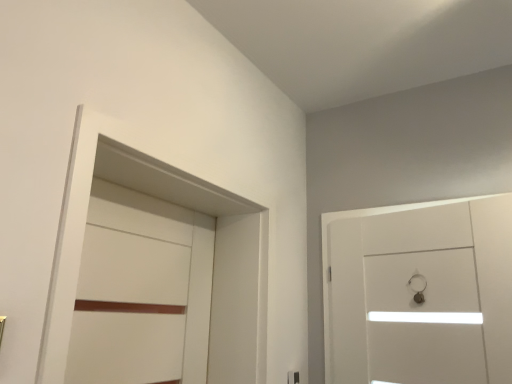
What is the approximate width of white glossy door at right, the 2th door in the left-to-right sequence?

6.93 inches.

Image resolution: width=512 pixels, height=384 pixels. I want to click on white matte door at left, arranged as the second door when viewed from the right, so click(x=142, y=291).

From a real-world perspective, count 2nd doors downward from the white matte locker at left and point to it. Please provide its 2D coordinates.

[(142, 291)]

From a real-world perspective, is white matte locker at left physically located above or below white matte door at left, arranged as the second door when viewed from the right?

Clearly, from a real-world perspective, white matte locker at left is above white matte door at left, arranged as the second door when viewed from the right.

From the image's perspective, is white matte locker at left under white matte door at left, which ranks as the 1th door in left-to-right order?

Incorrect, from the image's perspective, white matte locker at left is higher than white matte door at left, which ranks as the 1th door in left-to-right order.

Looking at this image, from the image's perspective, which one is positioned lower, white glossy door at right, the 2th door in the left-to-right sequence, or white matte locker at left?

white glossy door at right, the 2th door in the left-to-right sequence, appears lower in the image.

Does point (503, 324) lie behind point (244, 224)?

No, it is in front of (244, 224).

From a real-world perspective, which is physically above, white glossy door at right, the first door positioned from the right, or white matte locker at left?

white matte locker at left, from a real-world perspective.

Choose the correct answer: Is white matte door at left, arranged as the second door when viewed from the right, inside white glossy door at right, the first door positioned from the right, or outside it?

white matte door at left, arranged as the second door when viewed from the right, is outside white glossy door at right, the first door positioned from the right.

Could you measure the distance between white matte door at left, which ranks as the 1th door in left-to-right order, and white glossy door at right, the 2th door in the left-to-right sequence?

white matte door at left, which ranks as the 1th door in left-to-right order, and white glossy door at right, the 2th door in the left-to-right sequence, are 34.64 inches apart.

From a real-world perspective, which is physically above, white matte door at left, arranged as the second door when viewed from the right, or white glossy door at right, the first door positioned from the right?

white glossy door at right, the first door positioned from the right, from a real-world perspective.

Considering the relative sizes of white matte door at left, arranged as the second door when viewed from the right, and white glossy door at right, the first door positioned from the right, in the image provided, is white matte door at left, arranged as the second door when viewed from the right, bigger than white glossy door at right, the first door positioned from the right,?

No, white matte door at left, arranged as the second door when viewed from the right, is not bigger than white glossy door at right, the first door positioned from the right.

Is the position of white glossy door at right, the 2th door in the left-to-right sequence, less distant than that of white matte door at left, which ranks as the 1th door in left-to-right order?

No, white glossy door at right, the 2th door in the left-to-right sequence, is further to the viewer.

Is white glossy door at right, the 2th door in the left-to-right sequence, to the left or to the right of white matte door at left, arranged as the second door when viewed from the right, in the image?

From the image, it's evident that white glossy door at right, the 2th door in the left-to-right sequence, is to the right of white matte door at left, arranged as the second door when viewed from the right.

Considering the sizes of white glossy door at right, the 2th door in the left-to-right sequence, and white matte door at left, which ranks as the 1th door in left-to-right order, in the image, is white glossy door at right, the 2th door in the left-to-right sequence, taller or shorter than white matte door at left, which ranks as the 1th door in left-to-right order,?

white glossy door at right, the 2th door in the left-to-right sequence, is taller than white matte door at left, which ranks as the 1th door in left-to-right order.

Is white matte locker at left closer to camera compared to white glossy door at right, the first door positioned from the right?

Yes, it is.

Considering the relative sizes of white matte locker at left and white glossy door at right, the 2th door in the left-to-right sequence, in the image provided, is white matte locker at left wider than white glossy door at right, the 2th door in the left-to-right sequence,?

Indeed, white matte locker at left has a greater width compared to white glossy door at right, the 2th door in the left-to-right sequence.

Could you tell me if white matte locker at left is facing white glossy door at right, the first door positioned from the right?

Yes, white matte locker at left faces towards white glossy door at right, the first door positioned from the right.

Considering the positions of objects white matte locker at left and white glossy door at right, the first door positioned from the right, in the image provided, who is more to the right, white matte locker at left or white glossy door at right, the first door positioned from the right,?

From the viewer's perspective, white glossy door at right, the first door positioned from the right, appears more on the right side.

Considering the relative sizes of white matte door at left, which ranks as the 1th door in left-to-right order, and white matte locker at left in the image provided, is white matte door at left, which ranks as the 1th door in left-to-right order, thinner than white matte locker at left?

Indeed, white matte door at left, which ranks as the 1th door in left-to-right order, has a lesser width compared to white matte locker at left.

From the image's perspective, would you say white matte door at left, arranged as the second door when viewed from the right, is shown under white matte locker at left?

Correct, white matte door at left, arranged as the second door when viewed from the right, appears lower than white matte locker at left in the image.

Can you see white matte door at left, which ranks as the 1th door in left-to-right order, touching white matte locker at left?

No.

Which object is further away from the camera, white matte door at left, which ranks as the 1th door in left-to-right order, or white matte locker at left?

Positioned behind is white matte door at left, which ranks as the 1th door in left-to-right order.

The height and width of the screenshot is (384, 512). Identify the location of door that is the 2nd one below the white matte locker at left (from a real-world perspective). (142, 291).

Locate an element on the screen. the 2nd door behind the white matte locker at left, counting from the anchor's position is located at coordinates (424, 295).

Based on their spatial positions, is white matte door at left, arranged as the second door when viewed from the right, or white matte locker at left closer to white glossy door at right, the 2th door in the left-to-right sequence?

Among the two, white matte locker at left is located nearer to white glossy door at right, the 2th door in the left-to-right sequence.

Considering their positions, is white matte door at left, arranged as the second door when viewed from the right, positioned closer to white matte locker at left than white glossy door at right, the 2th door in the left-to-right sequence?

Among the two, white matte door at left, arranged as the second door when viewed from the right, is located nearer to white matte locker at left.

Based on the photo, from the image, which object appears to be nearer to white glossy door at right, the first door positioned from the right, white matte locker at left or white matte door at left, arranged as the second door when viewed from the right?

Based on the image, white matte locker at left appears to be nearer to white glossy door at right, the first door positioned from the right.

Considering their positions, is white matte locker at left positioned closer to white matte door at left, arranged as the second door when viewed from the right, than white glossy door at right, the 2th door in the left-to-right sequence?

white matte locker at left.

When comparing their distances from white matte locker at left, does white glossy door at right, the first door positioned from the right, or white matte door at left, arranged as the second door when viewed from the right, seem further?

white glossy door at right, the first door positioned from the right, lies further to white matte locker at left than the other object.

Considering their positions, is white glossy door at right, the 2th door in the left-to-right sequence, positioned closer to white matte door at left, which ranks as the 1th door in left-to-right order, than white matte locker at left?

Among the two, white matte locker at left is located nearer to white matte door at left, which ranks as the 1th door in left-to-right order.

Locate an element on the screen. Image resolution: width=512 pixels, height=384 pixels. locker situated between white matte door at left, which ranks as the 1th door in left-to-right order, and white glossy door at right, the first door positioned from the right, from left to right is located at coordinates (173, 202).